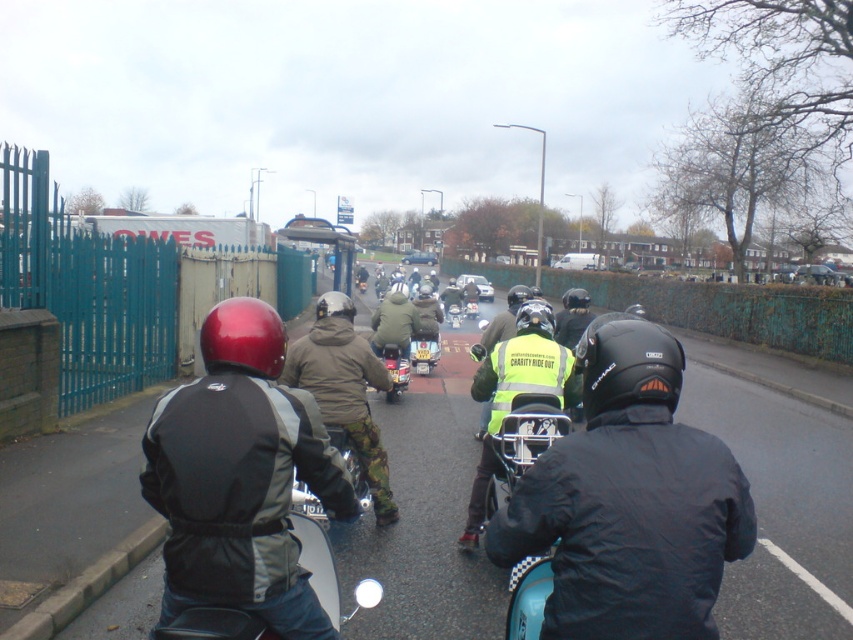
In the scene shown: Is black matte helmet at center wider than yellow reflective vest at center?

No.

The image size is (853, 640). Find the location of `black matte helmet at center`. black matte helmet at center is located at coordinates (630, 500).

Where is `black matte helmet at center`? black matte helmet at center is located at coordinates (630, 500).

Which is more to the right, camouflage pants at center or camouflage jacket at center?

Positioned to the right is camouflage pants at center.

Is camouflage pants at center behind camouflage jacket at center?

No.

Which is behind, point (317, 308) or point (376, 342)?

The point (376, 342) is more distant.

I want to click on camouflage pants at center, so click(x=344, y=388).

Between metallic gold motorcycle at center and metallic silver scooter at center, which one is positioned higher?

Positioned higher is metallic silver scooter at center.

Can you confirm if metallic gold motorcycle at center is positioned to the right of metallic silver scooter at center?

No, metallic gold motorcycle at center is not to the right of metallic silver scooter at center.

This screenshot has height=640, width=853. I want to click on metallic gold motorcycle at center, so click(424, 349).